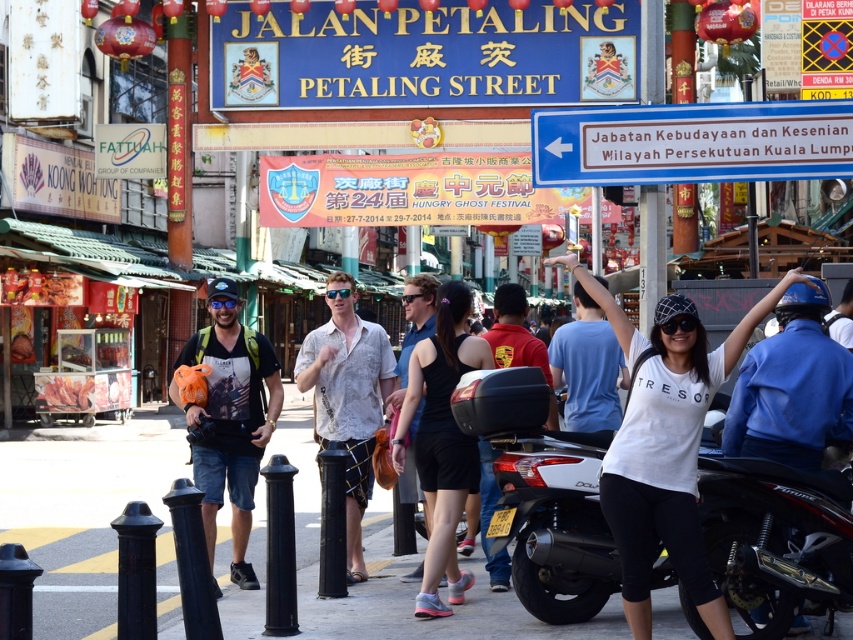
Question: Based on their relative distances, which object is farther from the white cotton shirt at center?

Choices:
 (A) blue metallic sign at upper right
 (B) blue cotton shirt at center

Answer: (B)

Question: Where is gray concrete pavement at center located in relation to blue cotton shirt at center in the image?

Choices:
 (A) below
 (B) above

Answer: (A)

Question: Observing the image, what is the correct spatial positioning of white textured shirt at center in reference to red shirt at center?

Choices:
 (A) left
 (B) right

Answer: (A)

Question: Which point is closer to the camera?

Choices:
 (A) white textured shirt at center
 (B) red shirt at center

Answer: (B)

Question: Can you confirm if gray concrete pavement at center is positioned to the right of matte black backpack at center?

Choices:
 (A) yes
 (B) no

Answer: (B)

Question: Which point is closer to the camera?

Choices:
 (A) pos(415,422)
 (B) pos(422,576)
 (C) pos(173,362)

Answer: (B)